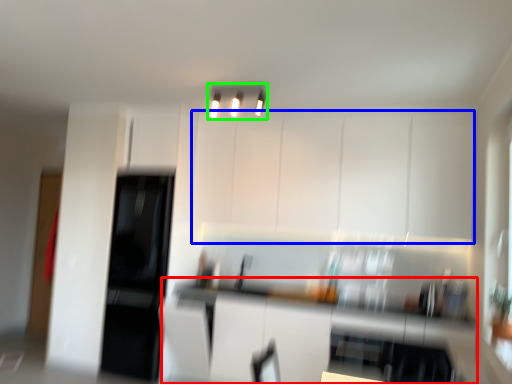
Question: Estimate the real-world distances between objects in this image. Which object is farther from counter top (highlighted by a red box), cabinetry (highlighted by a blue box) or light fixture (highlighted by a green box)?

Choices:
 (A) cabinetry
 (B) light fixture

Answer: (B)